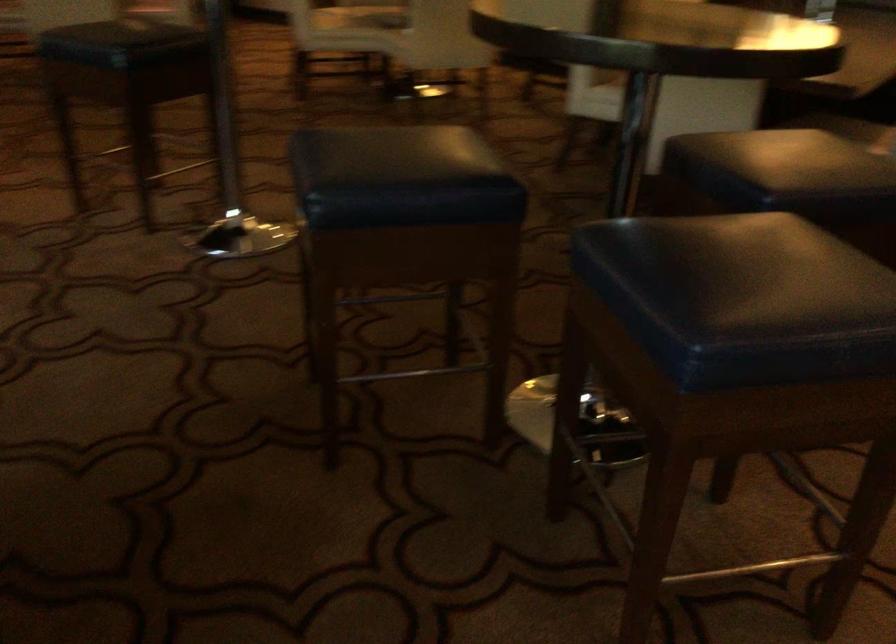
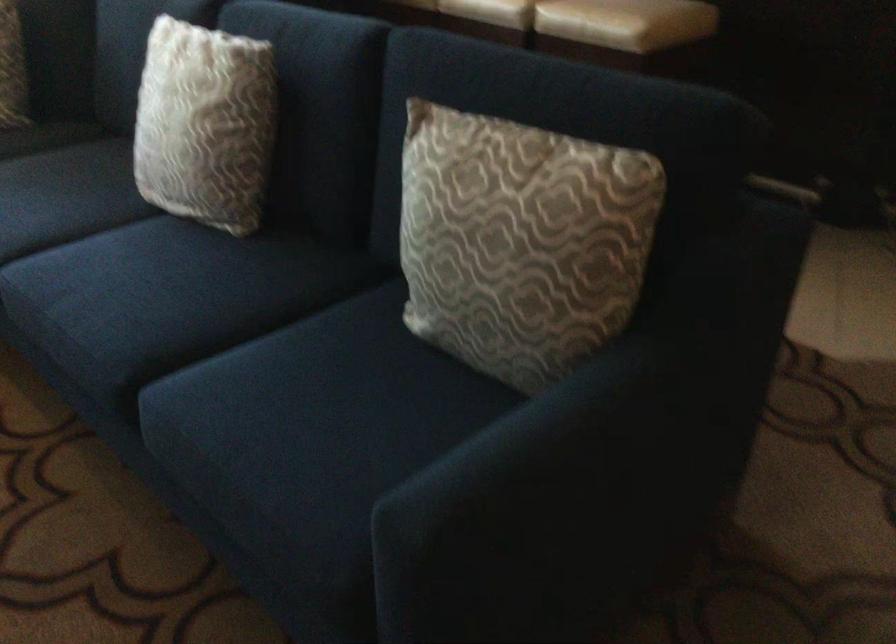
The images are taken continuously from a first-person perspective. In which direction is your viewpoint rotating?

The camera's rotation is toward left-down.